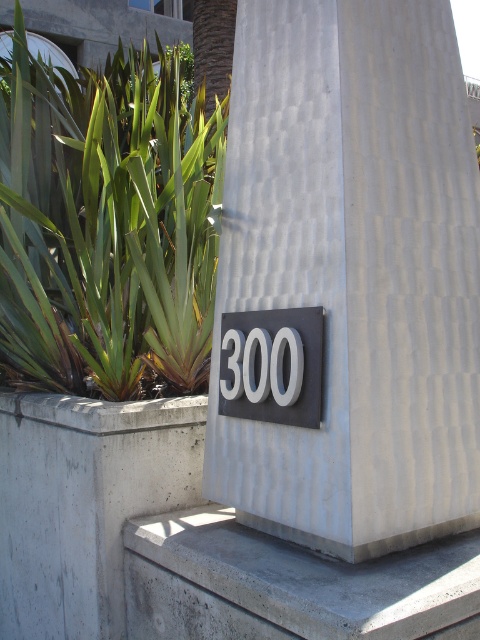
You are a delivery person trying to place a package on the gray concrete ledge at lower center. However, you notice the matte black sign at center is also present. Will the package fit on the ledge if it is the same size as the matte black sign?

The gray concrete ledge at lower center has a larger size compared to the matte black sign at center, so the package, being the same size as the matte black sign at center, will fit on the ledge.

You are standing in front of the textured wall corner with the address sign. There are two points marked on the wall. One is at coordinate point (184,74) and the other at point (472,592). Which point is closer to you?

Point (472,592) is closer to you because it is in front of point (184,74).

You are standing in front of a wall with a textured corner and an address sign. You need to place a small plant between the concrete at center and the matte black sign at center. According to the scene, where should you position the plant?

The concrete at center is to the left of the matte black sign at center, so you should place the small plant between them on the right side of the concrete at center and the left side of the matte black sign at center.